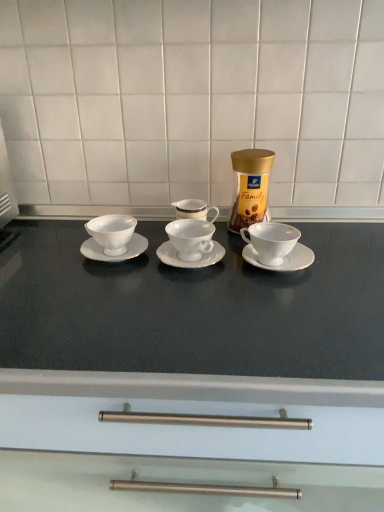
Question: From a real-world perspective, is white porcelain saucer at left, the 1th saucer in the left-to-right sequence, positioned under gold metallic jar at center based on gravity?

Choices:
 (A) no
 (B) yes

Answer: (B)

Question: Can you see white porcelain saucer at left, the 1th saucer in the left-to-right sequence, touching gold metallic jar at center?

Choices:
 (A) no
 (B) yes

Answer: (A)

Question: From the image's perspective, is white porcelain saucer at left, the third saucer from the right, under gold metallic jar at center?

Choices:
 (A) yes
 (B) no

Answer: (A)

Question: Considering the relative sizes of white porcelain saucer at left, the third saucer from the right, and gold metallic jar at center in the image provided, is white porcelain saucer at left, the third saucer from the right, smaller than gold metallic jar at center?

Choices:
 (A) yes
 (B) no

Answer: (A)

Question: Would you say white porcelain saucer at left, the 1th saucer in the left-to-right sequence, is outside gold metallic jar at center?

Choices:
 (A) no
 (B) yes

Answer: (B)

Question: Is white porcelain saucer at left, the 1th saucer in the left-to-right sequence, positioned behind gold metallic jar at center?

Choices:
 (A) no
 (B) yes

Answer: (A)

Question: Is white ceramic saucer at right, marked as the 3th saucer in a left-to-right arrangement, further to camera compared to gold metallic jar at center?

Choices:
 (A) yes
 (B) no

Answer: (B)

Question: From a real-world perspective, is white ceramic saucer at right, positioned as the first saucer in right-to-left order, under gold metallic jar at center?

Choices:
 (A) no
 (B) yes

Answer: (B)

Question: From the image's perspective, does white ceramic saucer at right, positioned as the first saucer in right-to-left order, appear lower than gold metallic jar at center?

Choices:
 (A) no
 (B) yes

Answer: (B)

Question: Considering the relative sizes of white ceramic saucer at right, marked as the 3th saucer in a left-to-right arrangement, and gold metallic jar at center in the image provided, is white ceramic saucer at right, marked as the 3th saucer in a left-to-right arrangement, shorter than gold metallic jar at center?

Choices:
 (A) yes
 (B) no

Answer: (A)

Question: Is white ceramic saucer at right, positioned as the first saucer in right-to-left order, next to gold metallic jar at center?

Choices:
 (A) no
 (B) yes

Answer: (A)

Question: Is white ceramic saucer at right, positioned as the first saucer in right-to-left order, located outside gold metallic jar at center?

Choices:
 (A) yes
 (B) no

Answer: (A)

Question: Can you confirm if white porcelain cup at right, acting as the 1th coffee cup starting from the right, is thinner than matte white countertop at center?

Choices:
 (A) no
 (B) yes

Answer: (B)